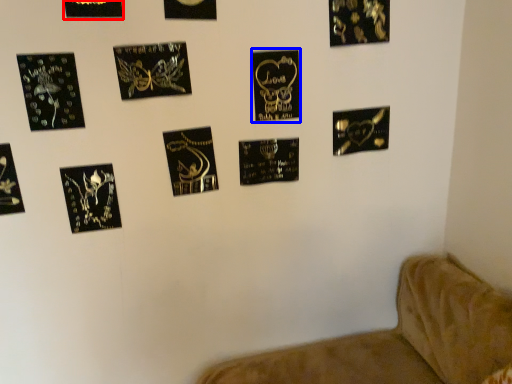
Question: Which object appears farthest to the camera in this image, picture frame (highlighted by a red box) or picture frame (highlighted by a blue box)?

Choices:
 (A) picture frame
 (B) picture frame

Answer: (B)